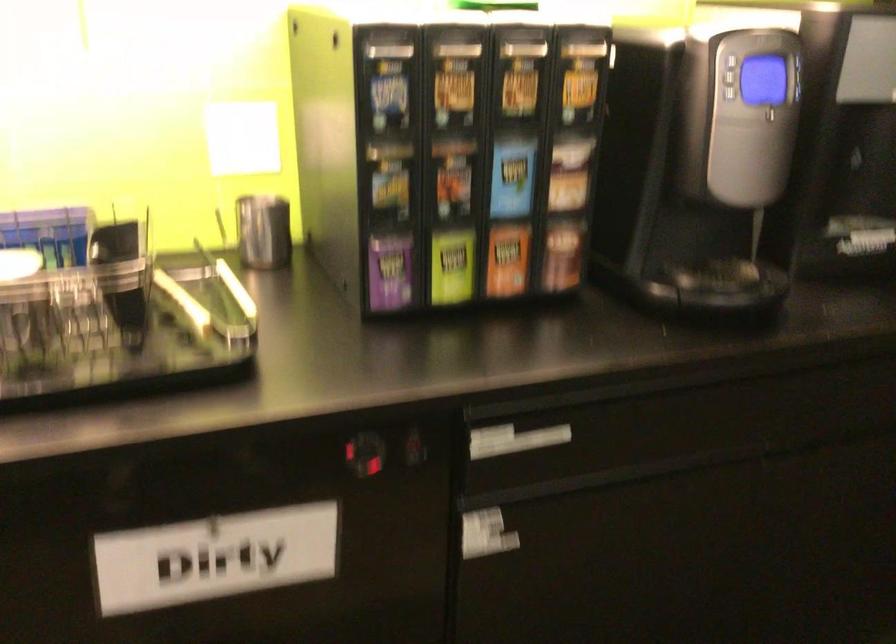
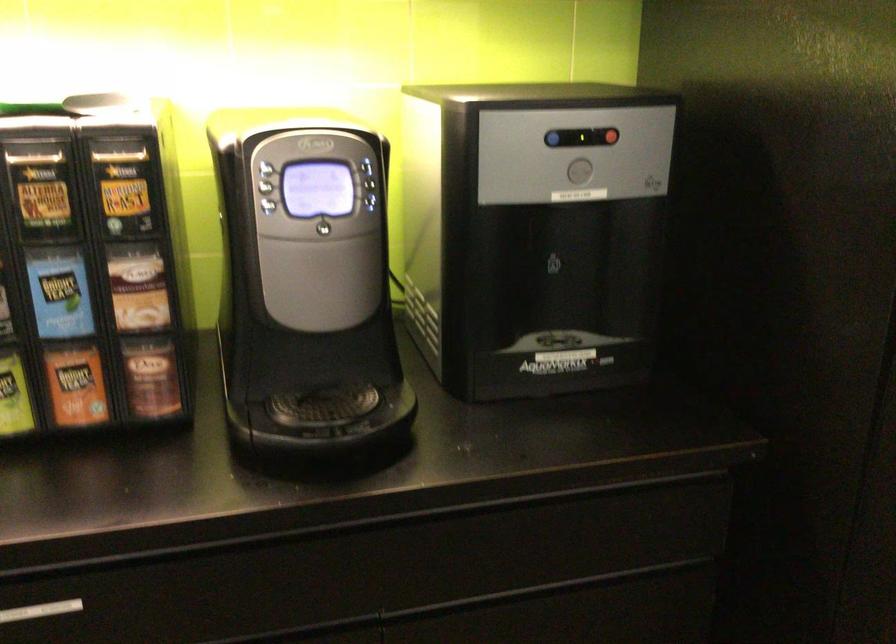
Where in the second image is the point corresponding to pixel 536 446 from the first image?

(40, 611)